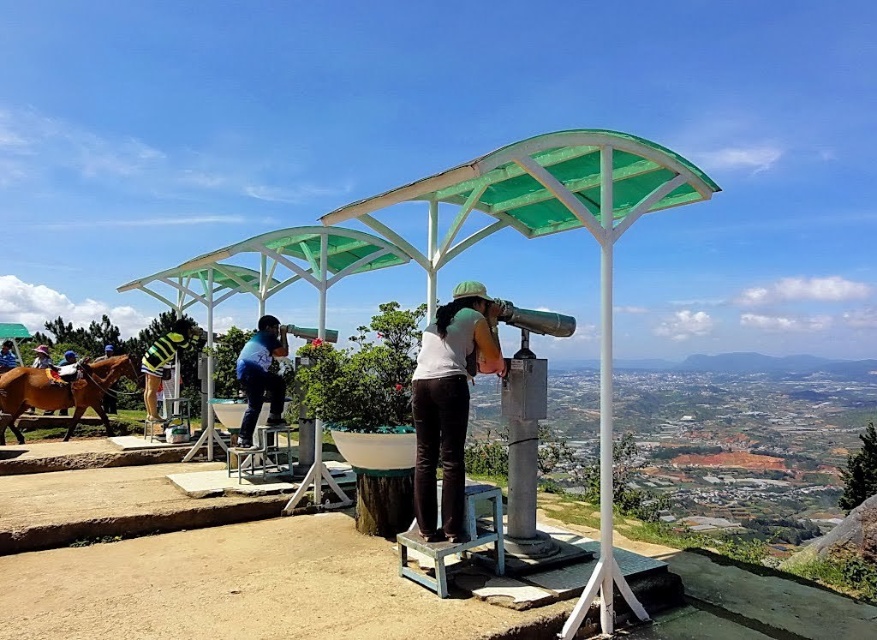
You are a photographer trying to capture a photo of both the striped jersey at center and the blue striped shirt at left in the same frame. Based on their positions, which one should you adjust your camera to focus on first to ensure both are in the frame?

You should focus on the blue striped shirt at left first since the striped jersey at center is to the right of it, allowing you to adjust the camera to include both in the frame.

You are a tour guide at the overlook point and need to ensure visitors maintain a safe distance of at least 4 meters between each other. There are two visitors, one wearing a white matte shirt at center and another person using a telescope slightly lower down. Can you confirm if they are maintaining the required distance?

The two visitors are 3.90 meters apart, which is slightly less than the required 4 meters. Therefore, they are not maintaining the safe distance and should move further apart.